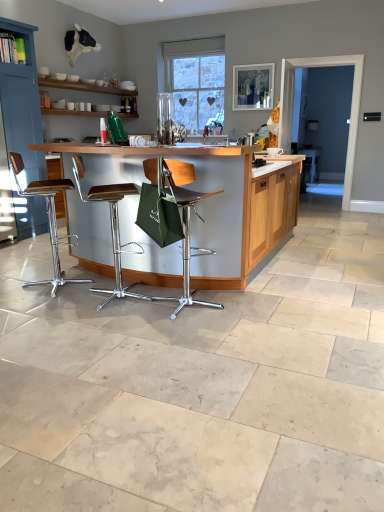
Question: Does transparent glass door at right have a smaller size compared to blue painted wood cabinet at left?

Choices:
 (A) no
 (B) yes

Answer: (B)

Question: Is transparent glass door at right positioned behind blue painted wood cabinet at left?

Choices:
 (A) yes
 (B) no

Answer: (A)

Question: Can you confirm if transparent glass door at right is shorter than blue painted wood cabinet at left?

Choices:
 (A) no
 (B) yes

Answer: (A)

Question: Are transparent glass door at right and blue painted wood cabinet at left located far from each other?

Choices:
 (A) no
 (B) yes

Answer: (B)

Question: Is transparent glass door at right in front of blue painted wood cabinet at left?

Choices:
 (A) yes
 (B) no

Answer: (B)

Question: From the image's perspective, would you say transparent glass door at right is shown under blue painted wood cabinet at left?

Choices:
 (A) no
 (B) yes

Answer: (A)

Question: Is metallic brown stool at center, acting as the 2th chair starting from the left, located within green fabric chair at center, the first chair positioned from the right?

Choices:
 (A) no
 (B) yes

Answer: (A)

Question: From the image's perspective, does green fabric chair at center, the first chair positioned from the right, appear higher than metallic brown stool at center, acting as the 2th chair starting from the left?

Choices:
 (A) yes
 (B) no

Answer: (B)

Question: Considering the relative positions of green fabric chair at center, the first chair positioned from the right, and metallic brown stool at center, acting as the 2th chair starting from the left, in the image provided, is green fabric chair at center, the first chair positioned from the right, to the right of metallic brown stool at center, acting as the 2th chair starting from the left, from the viewer's perspective?

Choices:
 (A) no
 (B) yes

Answer: (B)

Question: Can you confirm if green fabric chair at center, the first chair positioned from the right, is wider than metallic brown stool at center, placed as the second chair when sorted from right to left?

Choices:
 (A) yes
 (B) no

Answer: (B)

Question: Does green fabric chair at center, the first chair positioned from the right, appear on the left side of metallic brown stool at center, acting as the 2th chair starting from the left?

Choices:
 (A) no
 (B) yes

Answer: (A)

Question: Is green fabric chair at center, the first chair positioned from the right, not inside metallic brown stool at center, placed as the second chair when sorted from right to left?

Choices:
 (A) no
 (B) yes

Answer: (B)

Question: Is metallic brown stool at left, marked as the third chair in a right-to-left arrangement, at the left side of blue painted wood cabinet at left?

Choices:
 (A) yes
 (B) no

Answer: (B)